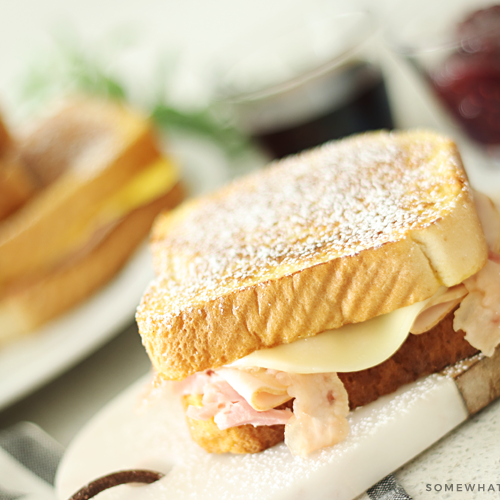
Find the location of a particular element. table is located at coordinates (465, 448).